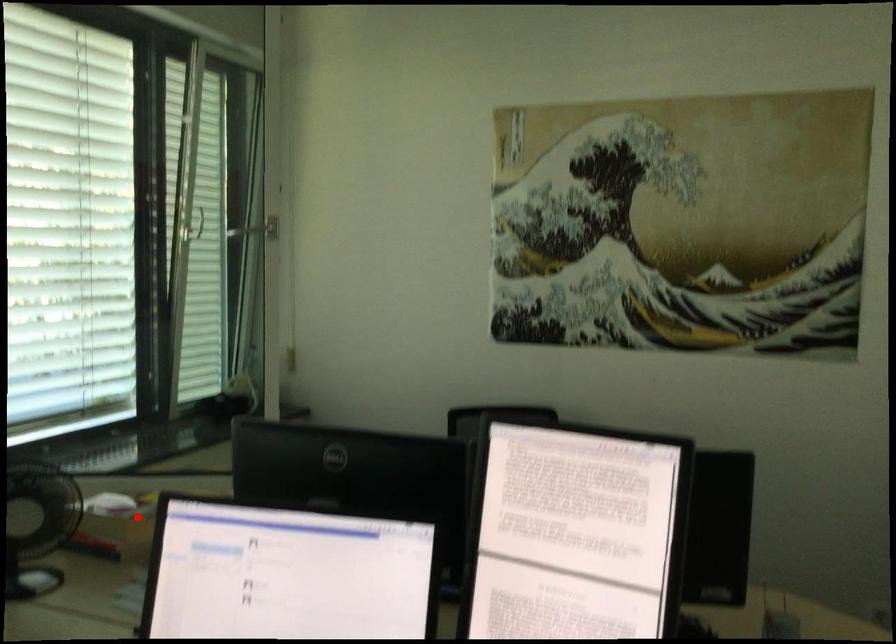
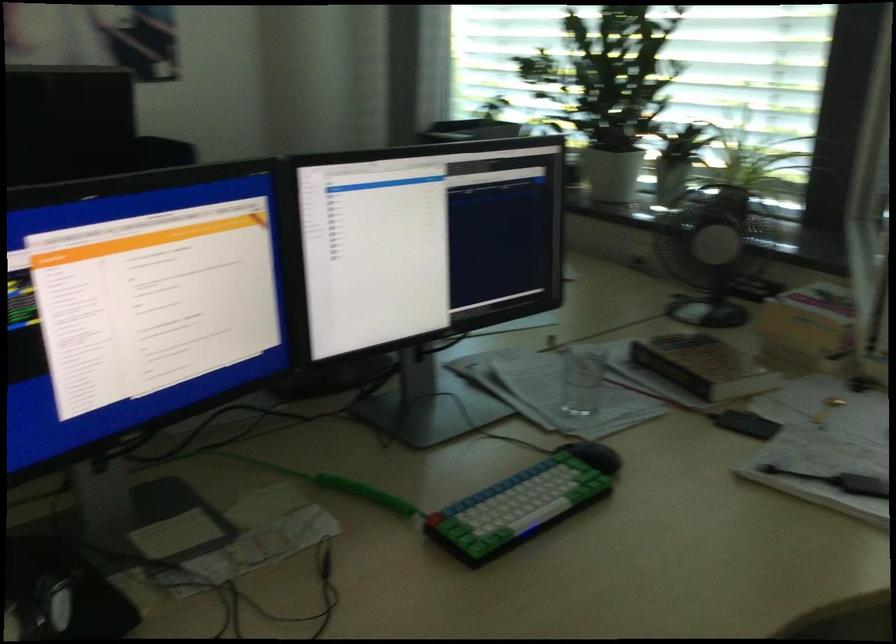
Question: I am providing you with two images of the same scene from different viewpoints. In image1, a red point is highlighted. Considering the same 3D point in image2, which of the following is correct?

Choices:
 (A) It is closer
 (B) It is farther

Answer: (A)